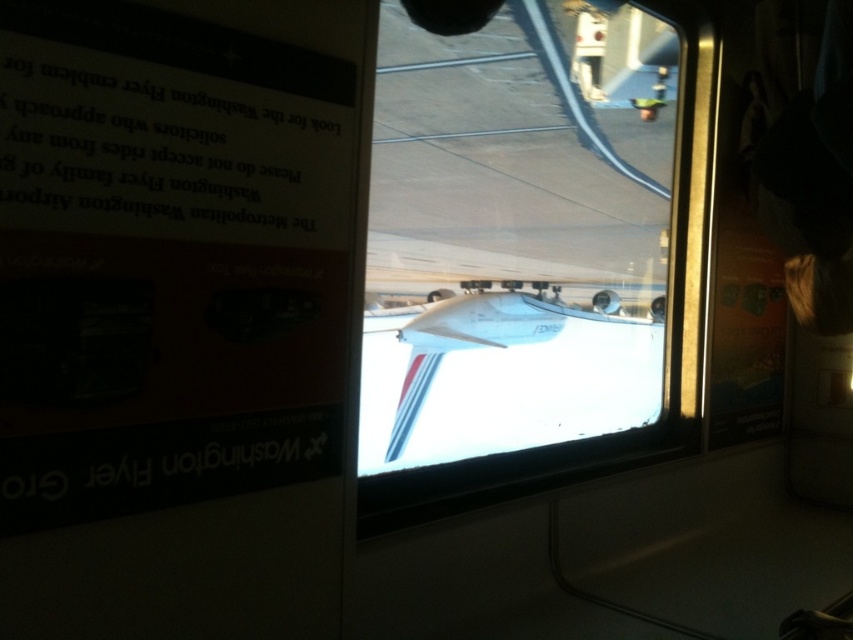
You are a passenger sitting in the airplane and notice both the transparent glass airplane window at center and the white glossy airplane at center. Which object is closer to your eyes?

The transparent glass airplane window at center is closer to your eyes because it is positioned further to the viewer than the white glossy airplane at center.

You are a passenger on a bus and want to check the outside weather through the transparent glass airplane window at center. However, there is a white glossy airplane at center blocking your view. Can you see the weather outside through the window without moving your head?

The transparent glass airplane window at center is narrower than the white glossy airplane at center. Since the window is narrower, it might be partially blocked by the airplane, so you might not have a clear view of the weather outside without moving your head.

You are a passenger on a bus at the airport. You notice two objects in the scene described. One is the transparent glass airplane window at center and the white glossy airplane at center. Which object is positioned higher from the ground?

The transparent glass airplane window at center is above the white glossy airplane at center, so the transparent glass airplane window at center is higher from the ground.